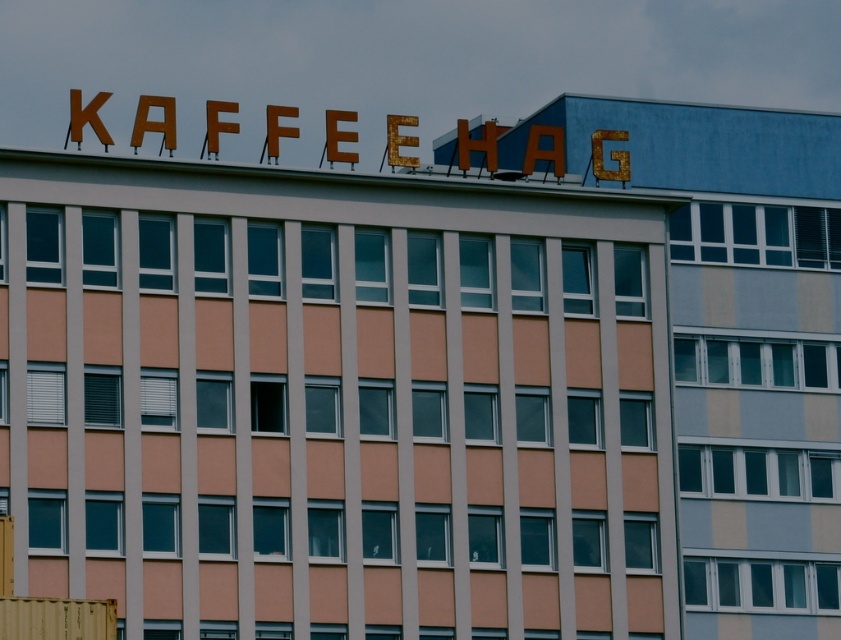
You are standing in front of the building and want to touch both the rusty metal sign at upper center and the yellow matte shipping container at lower left. Which object will you reach first?

The rusty metal sign at upper center is closer to you than the yellow matte shipping container at lower left, so you will reach the rusty metal sign at upper center first.

You are a delivery driver who needs to park your truck near the yellow matte shipping container at lower left. The truck requires a space that is at least as wide as the rusty metal sign at upper center. Based on the scene, can you park your truck there?

The rusty metal sign at upper center is wider than the yellow matte shipping container at lower left. Since the truck needs a space as wide as the sign, the shipping container area is not wide enough. Find another spot.

You are standing in front of the building and want to reach the point marked at coordinates point (728, 180). If your maximum reach is 70 meters, can you touch it without moving closer?

The point (728, 180) is 76.58 meters away from the camera, which exceeds your maximum reach of 70 meters. Therefore, you cannot touch it without moving closer.